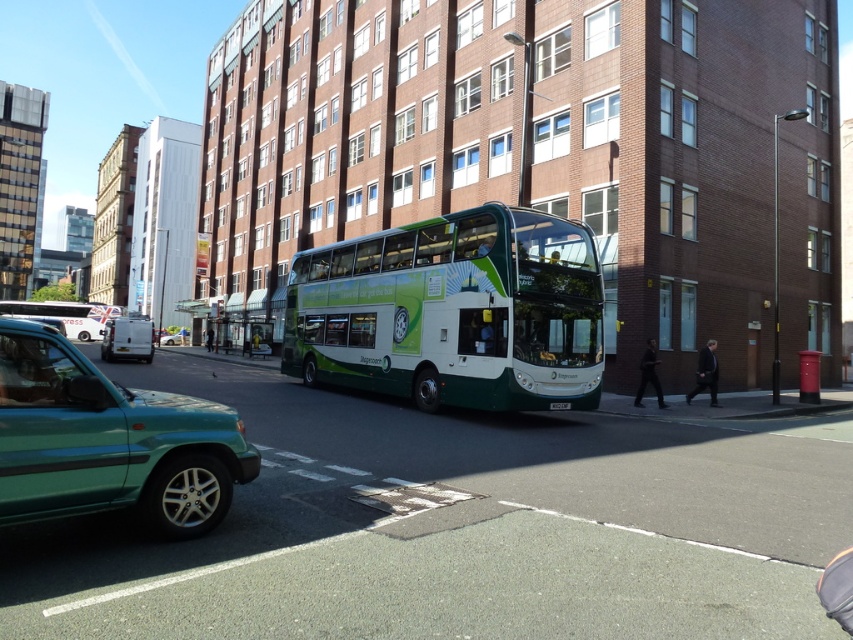
You are a pedestrian standing at the bus stop and want to cross the street. There is a green matte car at lower left and a white matte van at left. Which vehicle is closer to you?

The green matte car at lower left is closer to you because it is in front of the white matte van at left.

You are standing at the bus stop next to the double decker bus. You see a point marked at coordinate (65, 316). What object does this point correspond to?

The point at coordinate (65, 316) corresponds to the white metallic van at left.